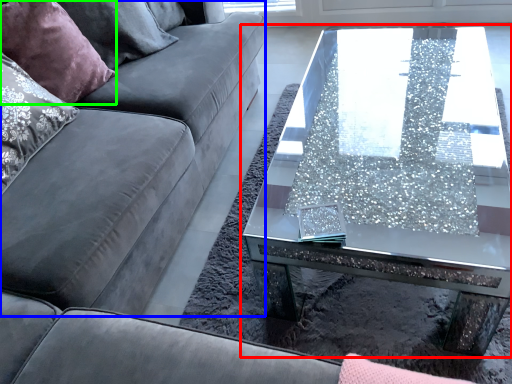
Question: Which object is positioned farthest from coffee table (highlighted by a red box)? Select from couch (highlighted by a blue box) and pillow (highlighted by a green box).

Choices:
 (A) couch
 (B) pillow

Answer: (B)